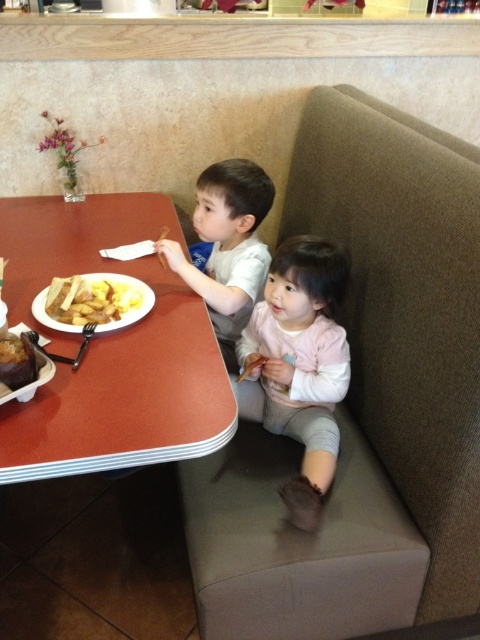
You are a parent trying to ensure your child eats their breakfast. You have a plate with yellow matte scrambled eggs at table left and a light pink fabric children at lower center. Which item is wider?

The light pink fabric children at lower center is wider than the yellow matte scrambled eggs at table left according to the description.

You are a parent trying to reach the yellow matte scrambled eggs at table left to serve your child. The light pink fabric children at lower center is in your way. Can you easily reach the scrambled eggs without moving the child?

The light pink fabric children at lower center is closer to the viewer than the yellow matte scrambled eggs at table left, so you can reach around the child to access the scrambled eggs.

You are a parent trying to place a rectangular placemat between the smooth red table at center and the pale pink fleece at lower center. The placemat is 12 inches wide. Can you fit it between them?

The smooth red table at center is wider than the pale pink fleece at lower center, so the 12 inch placemat can be placed between them as there is enough space.